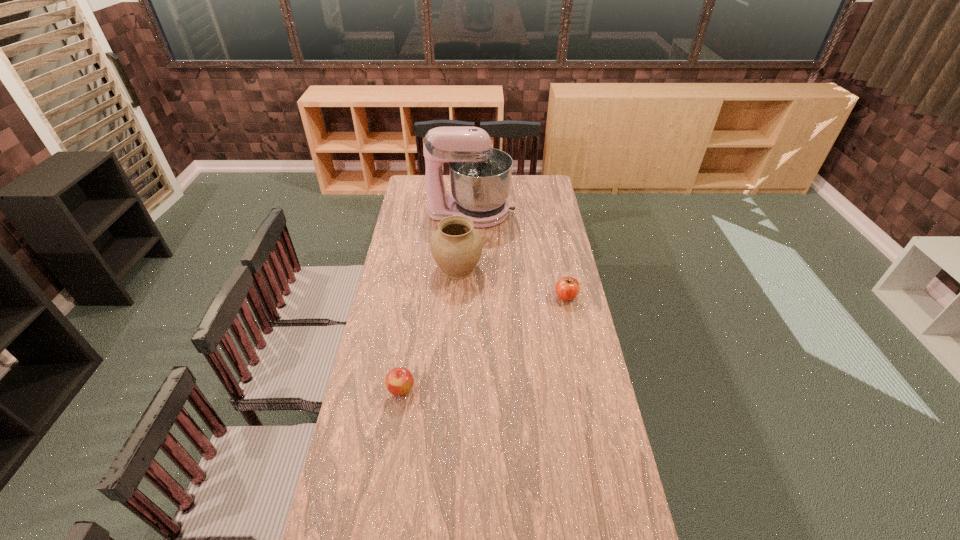
You are a GUI agent. You are given a task and a screenshot of the screen. Output one action in this format:
    pyautogui.click(x=<x>, y=<y>)
    Task: Click on the object that is the third closest to the farthest object
    
    Given the screenshot: What is the action you would take?
    pyautogui.click(x=399, y=381)

Image resolution: width=960 pixels, height=540 pixels. I want to click on the third closest object relative to the nearest object, so click(480, 176).

You are a GUI agent. You are given a task and a screenshot of the screen. Output one action in this format:
    pyautogui.click(x=<x>, y=<y>)
    Task: Click on the free point that satisfies the following two spatial constraints: 1. on the front-facing side of the mixer; 2. on the left side of the second nearest object
    Image resolution: width=960 pixels, height=540 pixels.
    Given the screenshot: What is the action you would take?
    pyautogui.click(x=469, y=296)

Where is `vacant region that satisfies the following two spatial constraints: 1. on the front-facing side of the farthest object; 2. on the front side of the nearer apple`? vacant region that satisfies the following two spatial constraints: 1. on the front-facing side of the farthest object; 2. on the front side of the nearer apple is located at coordinates (467, 389).

This screenshot has width=960, height=540. I want to click on free space that satisfies the following two spatial constraints: 1. on the front-facing side of the farthest object; 2. on the front side of the left apple, so click(467, 389).

This screenshot has height=540, width=960. I want to click on vacant space that satisfies the following two spatial constraints: 1. on the front-facing side of the mixer; 2. on the back side of the rightmost object, so click(x=469, y=296).